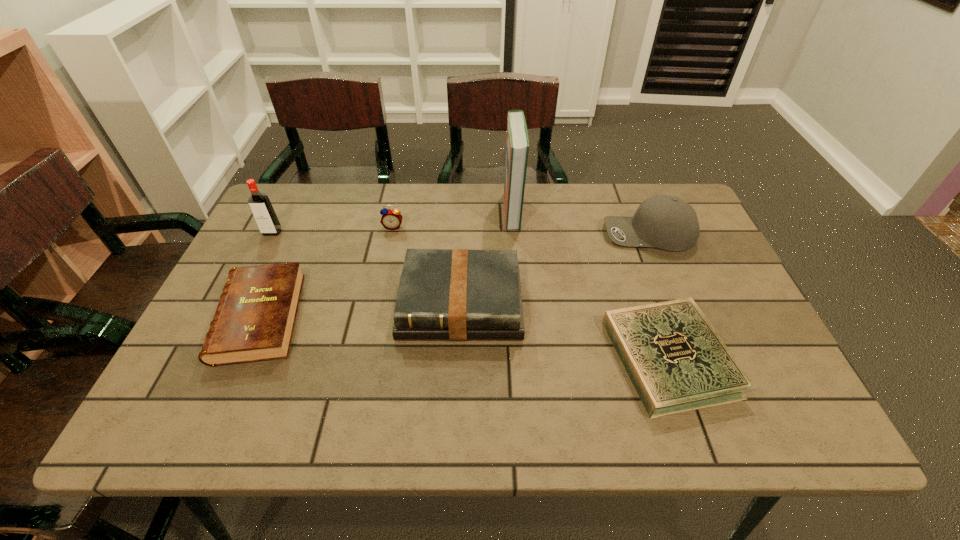
Identify the location of free spot between the second tallest hardback book and the leftmost hardback book. (360, 310).

This screenshot has width=960, height=540. I want to click on free space between the third shortest hardback book and the leftmost hardback book, so click(360, 310).

Find the location of a particular element. vacant space that is in between the tallest object and the shortest hardback book is located at coordinates (590, 285).

Locate an element on the screen. Image resolution: width=960 pixels, height=540 pixels. vacant space in between the farthest hardback book and the alarm clock is located at coordinates (452, 219).

At what (x,y) coordinates should I click in order to perform the action: click on unoccupied position between the second shortest hardback book and the third shortest hardback book. Please return your answer as a coordinate pair (x, y). Looking at the image, I should click on (360, 310).

Identify which object is the fourth closest to the tallest hardback book. Please provide its 2D coordinates. Your answer should be formatted as a tuple, i.e. [(x, y)], where the tuple contains the x and y coordinates of a point satisfying the conditions above.

[(676, 361)]

Locate an element on the screen. object that is the sixth closest to the fifth shortest object is located at coordinates (260, 205).

Select which hardback book is the closest to the shortest object. Please provide its 2D coordinates. Your answer should be formatted as a tuple, i.e. [(x, y)], where the tuple contains the x and y coordinates of a point satisfying the conditions above.

[(444, 294)]

Identify which hardback book is located as the second nearest to the tallest object. Please provide its 2D coordinates. Your answer should be formatted as a tuple, i.e. [(x, y)], where the tuple contains the x and y coordinates of a point satisfying the conditions above.

[(676, 361)]

Find the location of a particular element. This screenshot has height=540, width=960. vacant space that satisfies the following two spatial constraints: 1. on the cover of the tallest object; 2. on the front-facing side of the fifth object from right to left is located at coordinates (514, 227).